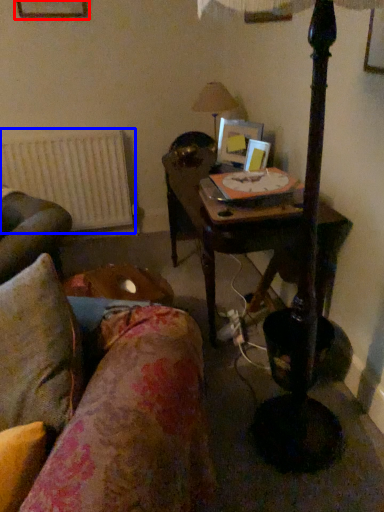
Question: Which point is further to the camera, picture frame (highlighted by a red box) or radiator (highlighted by a blue box)?

Choices:
 (A) picture frame
 (B) radiator

Answer: (B)